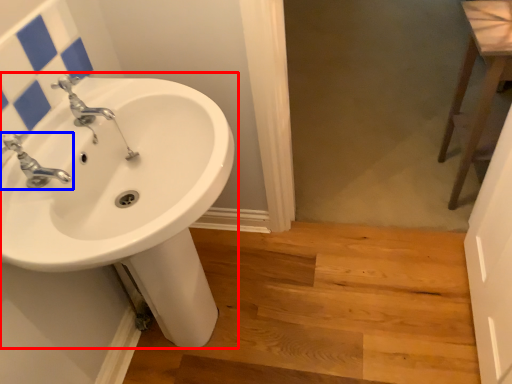
Question: Which of the following is the closest to the observer, sink (highlighted by a red box) or tap (highlighted by a blue box)?

Choices:
 (A) sink
 (B) tap

Answer: (A)